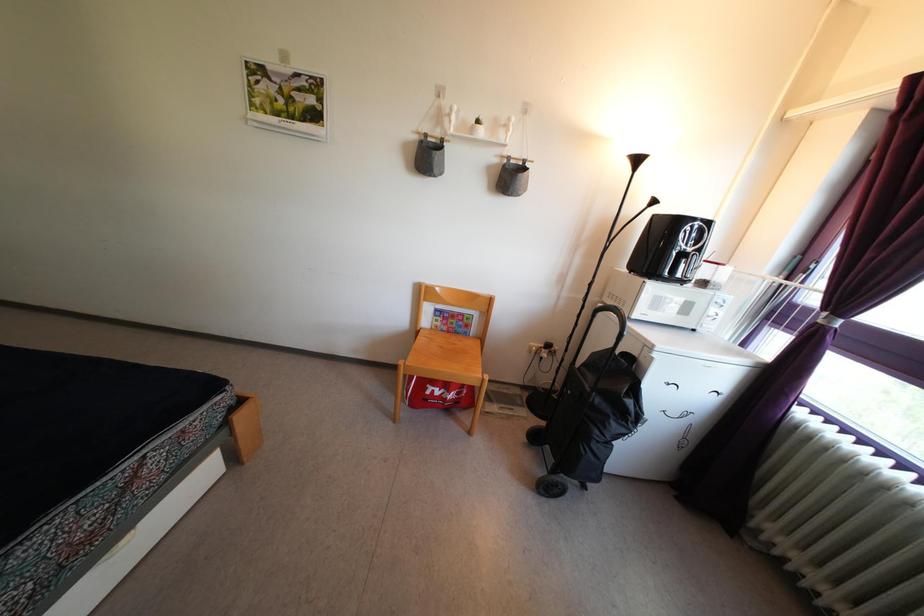
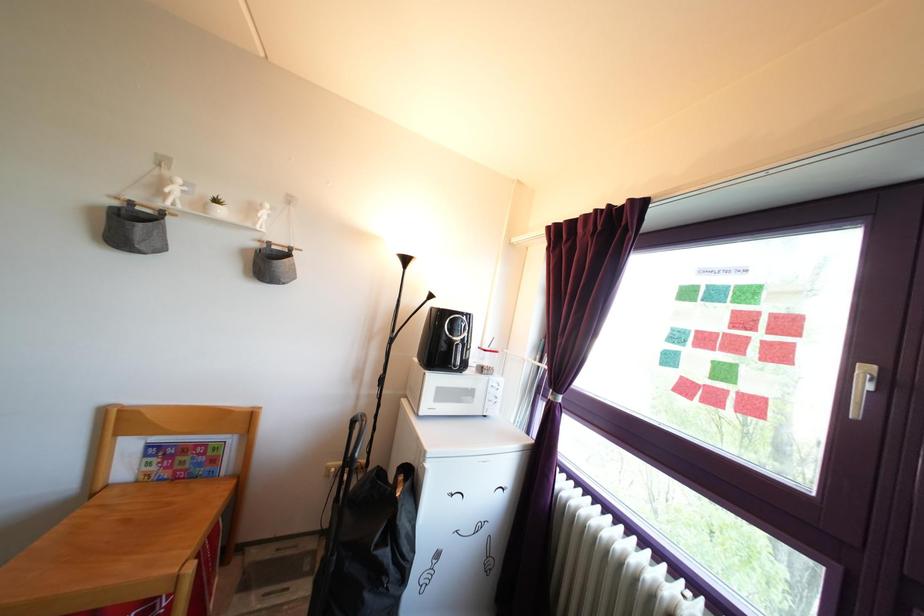
Where in the second image is the point corresponding to [533,355] from the first image?

(332, 477)